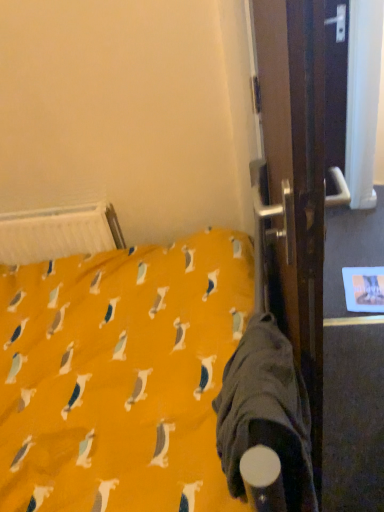
Question: Relative to white plastic radiator at upper left, is dark gray fabric sleeping bag at lower right in front or behind?

Choices:
 (A) front
 (B) behind

Answer: (A)

Question: In terms of height, does dark gray fabric sleeping bag at lower right look taller or shorter compared to white plastic radiator at upper left?

Choices:
 (A) tall
 (B) short

Answer: (A)

Question: Is dark gray fabric sleeping bag at lower right bigger or smaller than white plastic radiator at upper left?

Choices:
 (A) big
 (B) small

Answer: (A)

Question: Is white plastic radiator at upper left situated inside dark gray fabric sleeping bag at lower right or outside?

Choices:
 (A) outside
 (B) inside

Answer: (A)

Question: Is point (120, 245) positioned closer to the camera than point (311, 504)?

Choices:
 (A) closer
 (B) farther

Answer: (B)

Question: Looking at the image, does white plastic radiator at upper left seem bigger or smaller compared to dark gray fabric sleeping bag at lower right?

Choices:
 (A) big
 (B) small

Answer: (B)

Question: From the image's perspective, is white plastic radiator at upper left positioned above or below dark gray fabric sleeping bag at lower right?

Choices:
 (A) below
 (B) above

Answer: (B)